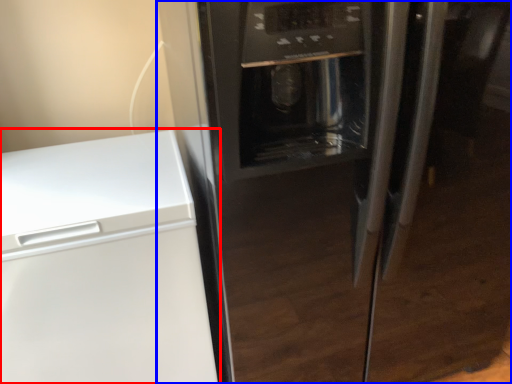
Question: Which object is closer to the camera taking this photo, home appliance (highlighted by a red box) or refrigerator (highlighted by a blue box)?

Choices:
 (A) home appliance
 (B) refrigerator

Answer: (B)